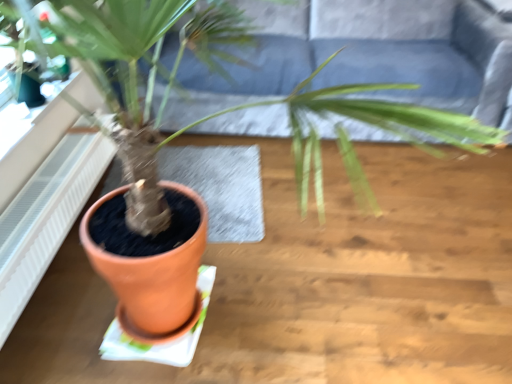
Question: Can you confirm if white textured radiator at left is thinner than dark gray fabric couch at upper center?

Choices:
 (A) no
 (B) yes

Answer: (B)

Question: Is white textured radiator at left turned away from dark gray fabric couch at upper center?

Choices:
 (A) no
 (B) yes

Answer: (A)

Question: Considering the relative sizes of white textured radiator at left and dark gray fabric couch at upper center in the image provided, is white textured radiator at left smaller than dark gray fabric couch at upper center?

Choices:
 (A) yes
 (B) no

Answer: (A)

Question: Is the position of white textured radiator at left more distant than that of dark gray fabric couch at upper center?

Choices:
 (A) no
 (B) yes

Answer: (A)

Question: From a real-world perspective, is white textured radiator at left located higher than dark gray fabric couch at upper center?

Choices:
 (A) no
 (B) yes

Answer: (A)

Question: Does white textured radiator at left turn towards dark gray fabric couch at upper center?

Choices:
 (A) no
 (B) yes

Answer: (A)

Question: From the image's perspective, is dark gray fabric couch at upper center below white textured radiator at left?

Choices:
 (A) no
 (B) yes

Answer: (A)

Question: Is dark gray fabric couch at upper center at the right side of white textured radiator at left?

Choices:
 (A) no
 (B) yes

Answer: (B)

Question: Does dark gray fabric couch at upper center have a lesser width compared to white textured radiator at left?

Choices:
 (A) yes
 (B) no

Answer: (B)

Question: Is dark gray fabric couch at upper center smaller than white textured radiator at left?

Choices:
 (A) no
 (B) yes

Answer: (A)

Question: Does dark gray fabric couch at upper center come behind white textured radiator at left?

Choices:
 (A) no
 (B) yes

Answer: (B)

Question: Is dark gray fabric couch at upper center aimed at white textured radiator at left?

Choices:
 (A) yes
 (B) no

Answer: (A)

Question: Is point (28, 294) positioned closer to the camera than point (498, 34)?

Choices:
 (A) farther
 (B) closer

Answer: (B)